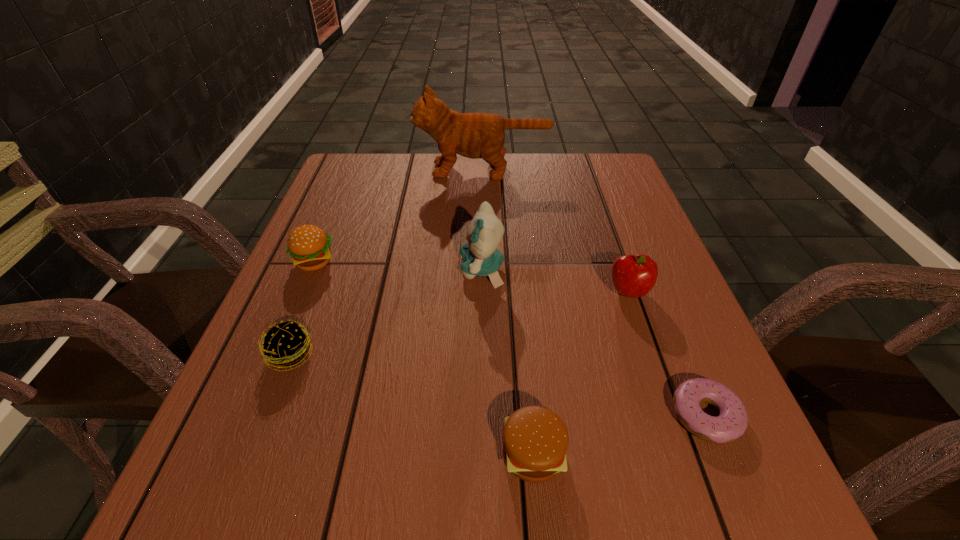
Where is `vacant space situated 0.070m on the face of the tallest object`? The image size is (960, 540). vacant space situated 0.070m on the face of the tallest object is located at coordinates (392, 170).

This screenshot has height=540, width=960. In order to click on vacant position located 0.160m on the face of the tallest object in this screenshot , I will do `click(360, 170)`.

The width and height of the screenshot is (960, 540). I want to click on free region located 0.050m on the face of the tallest object, so click(398, 170).

The height and width of the screenshot is (540, 960). What are the coordinates of `vacant region located on the face of the second tallest object` in the screenshot? It's located at (347, 270).

At what (x,y) coordinates should I click in order to perform the action: click on free location located 0.110m on the face of the second tallest object. Please return your answer as a coordinate pair (x, y). Looking at the image, I should click on (408, 270).

You are a GUI agent. You are given a task and a screenshot of the screen. Output one action in this format:
    pyautogui.click(x=<x>, y=<y>)
    Task: Click on the vacant area situated 0.260m on the face of the second tallest object
    The height and width of the screenshot is (540, 960).
    Given the screenshot: What is the action you would take?
    pyautogui.click(x=338, y=270)

At what (x,y) coordinates should I click in order to perform the action: click on blank space located on the front of the apple. Please return your answer as a coordinate pair (x, y). This screenshot has height=540, width=960. Looking at the image, I should click on (692, 477).

Identify the location of vacant space located 0.210m on the back of the farther hamburger. This screenshot has width=960, height=540. (342, 198).

Identify the location of vacant space located on the right of the patty. (433, 355).

This screenshot has width=960, height=540. Identify the location of vacant space located on the right of the nearer hamburger. (707, 454).